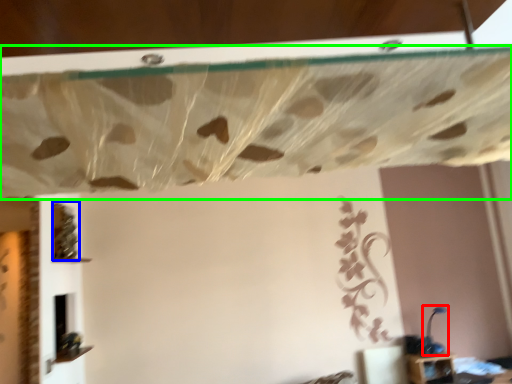
Question: Which object is the closest to the lamp (highlighted by a red box)? Choose among these: vine (highlighted by a blue box) or curtain (highlighted by a green box).

Choices:
 (A) vine
 (B) curtain

Answer: (A)